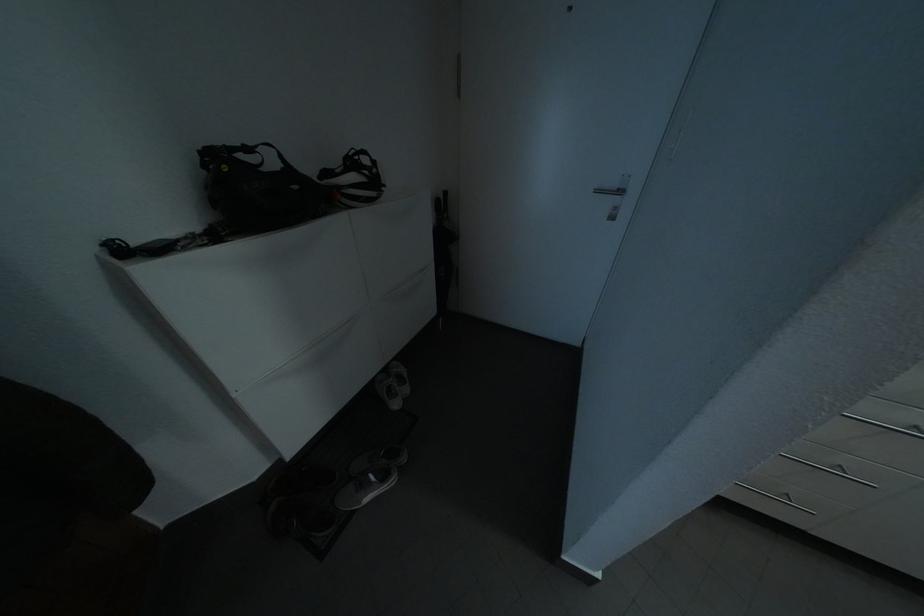
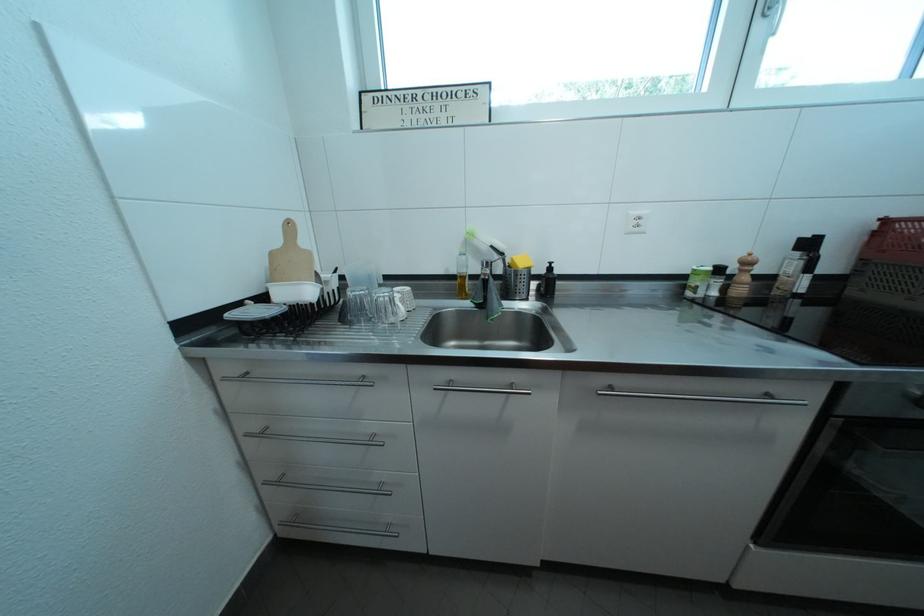
Question: Which direction would the cameraman need to move to produce the second image? Reply with the corresponding letter.

Choices:
 (A) Left
 (B) Right
 (C) Forward
 (D) Backward

Answer: (B)